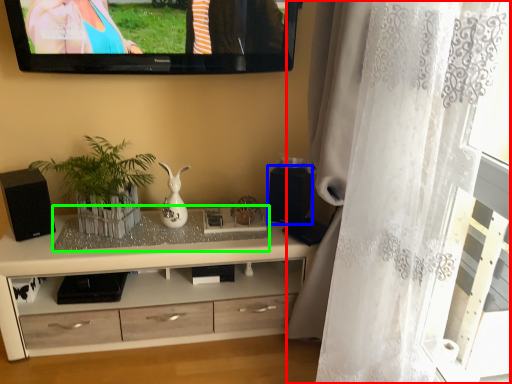
Question: Which is nearer to the curtain (highlighted by a red box)? speaker (highlighted by a blue box) or glass table (highlighted by a green box).

Choices:
 (A) speaker
 (B) glass table

Answer: (A)